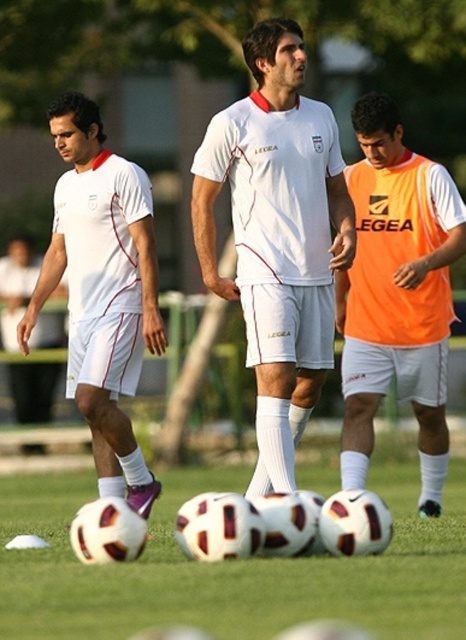
Question: Can you confirm if white matte soccer balls at center is wider than matte white shorts at left?

Choices:
 (A) yes
 (B) no

Answer: (A)

Question: Is white matte soccer balls at center below matte white shorts at left?

Choices:
 (A) yes
 (B) no

Answer: (A)

Question: Which object is farther from the camera taking this photo?

Choices:
 (A) white matte soccer balls at center
 (B) white matte jersey at center
 (C) orange mesh vest at center

Answer: (C)

Question: Does orange mesh vest at center come behind matte white shorts at left?

Choices:
 (A) no
 (B) yes

Answer: (A)

Question: Which object is positioned closest to the matte white shorts at left?

Choices:
 (A) white matte jersey at center
 (B) orange mesh vest at center
 (C) white matte soccer balls at center

Answer: (A)

Question: Which point is closer to the camera taking this photo?

Choices:
 (A) (408, 179)
 (B) (60, 228)

Answer: (A)